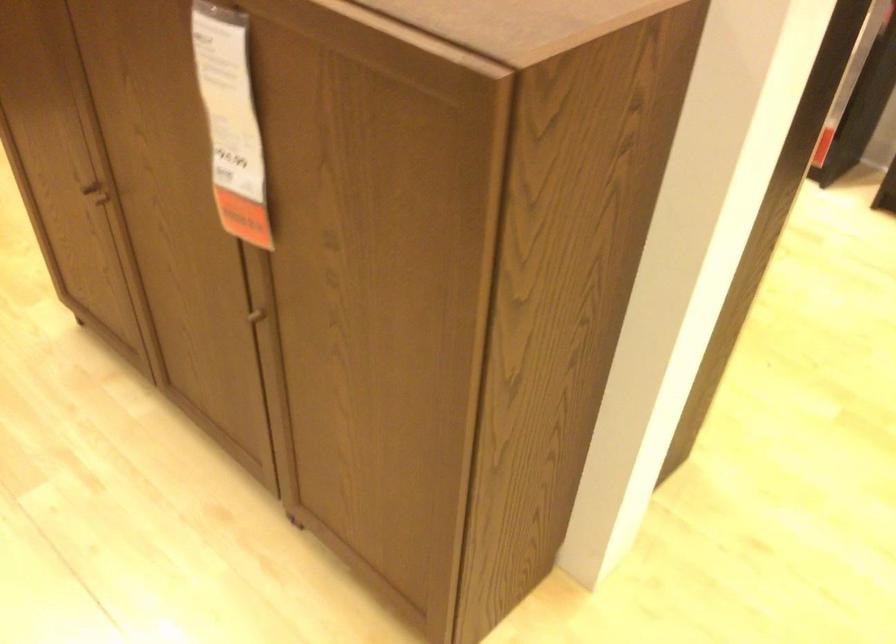
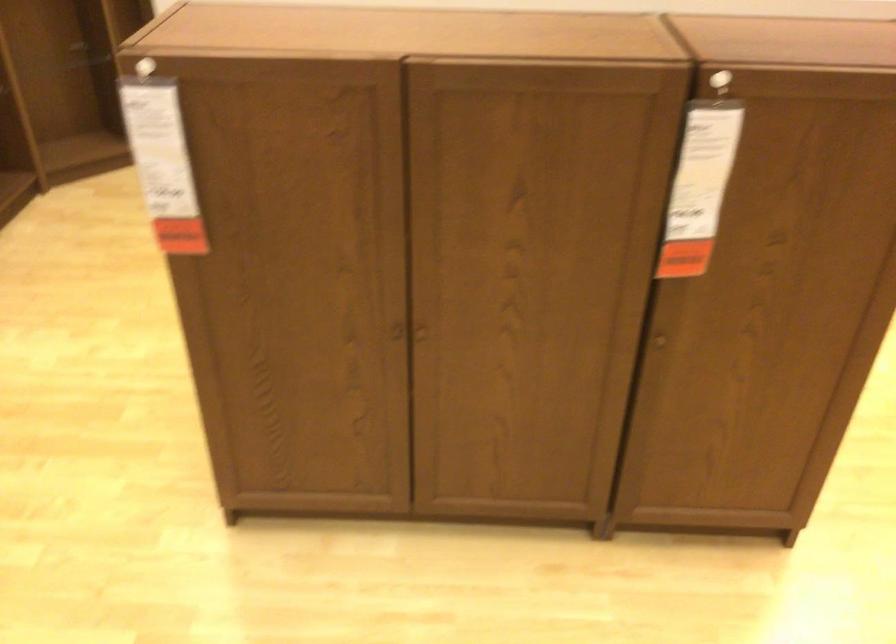
In the second image, find the point that corresponds to point 260,315 in the first image.

(659, 341)